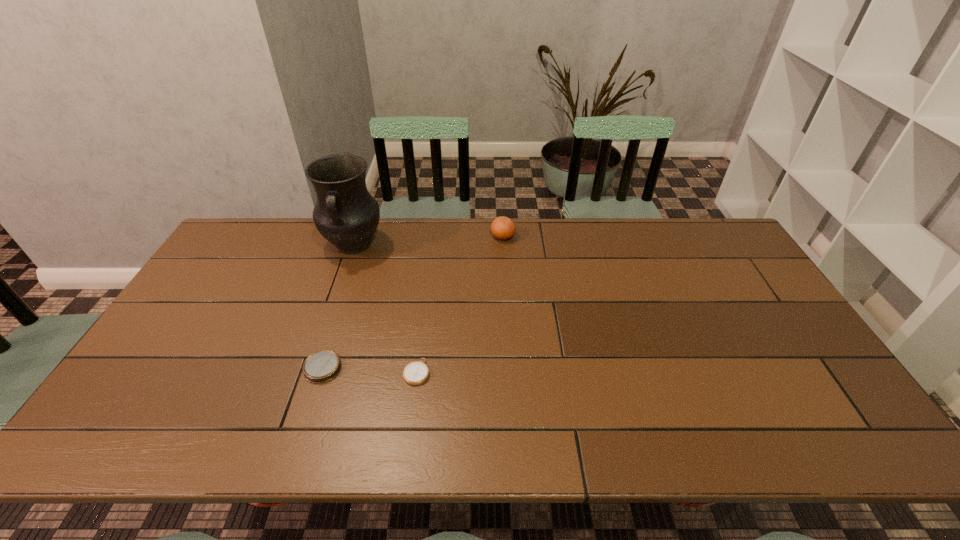
Locate an element on the screen. This screenshot has height=540, width=960. free spot between the left compass and the third shortest object is located at coordinates (413, 302).

In order to click on blank region between the tallest object and the third shortest object in this screenshot , I will do 428,241.

Image resolution: width=960 pixels, height=540 pixels. In order to click on free space between the rightmost object and the left compass in this screenshot , I will do `click(413, 302)`.

Where is `free spot between the left compass and the tallest object`? The height and width of the screenshot is (540, 960). free spot between the left compass and the tallest object is located at coordinates pyautogui.click(x=338, y=307).

At what (x,y) coordinates should I click in order to perform the action: click on free space between the left compass and the rightmost object. Please return your answer as a coordinate pair (x, y). The width and height of the screenshot is (960, 540). Looking at the image, I should click on (413, 302).

The width and height of the screenshot is (960, 540). In order to click on free space between the second shortest object and the shortest object in this screenshot , I will do [370, 370].

Where is `vacant area that lies between the shortest object and the pitcher`? Image resolution: width=960 pixels, height=540 pixels. vacant area that lies between the shortest object and the pitcher is located at coordinates (385, 309).

Identify which object is the third closest to the taller compass. Please provide its 2D coordinates. Your answer should be formatted as a tuple, i.e. [(x, y)], where the tuple contains the x and y coordinates of a point satisfying the conditions above.

[(503, 228)]

The height and width of the screenshot is (540, 960). Find the location of `object that can be found as the closest to the taller compass`. object that can be found as the closest to the taller compass is located at coordinates click(415, 373).

What are the coordinates of `blank space that satisfies the following two spatial constraints: 1. on the handle side of the pitcher; 2. on the right side of the second shortest object` in the screenshot? It's located at (311, 368).